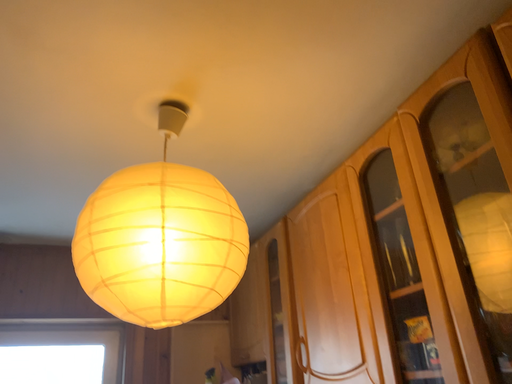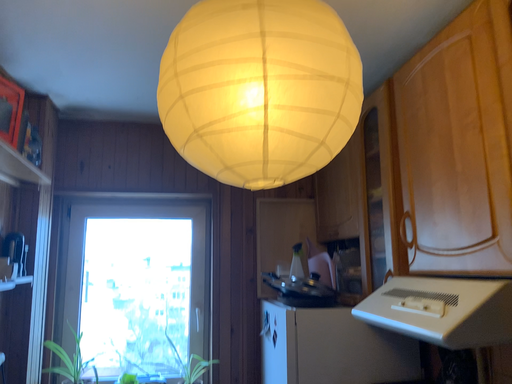
Question: How did the camera likely rotate when shooting the video?

Choices:
 (A) rotated downward
 (B) rotated upward

Answer: (A)